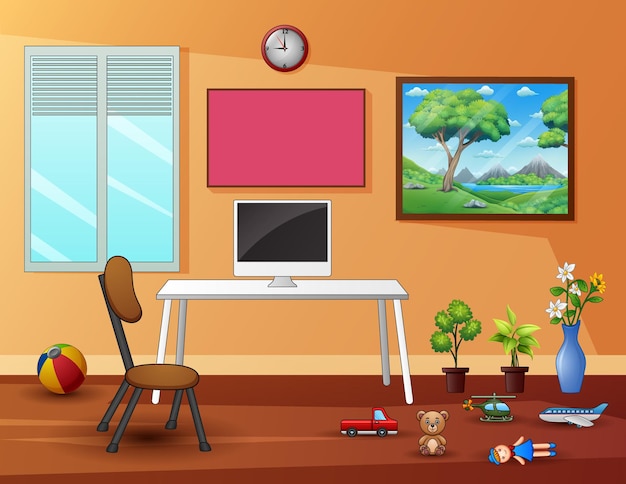
Find the location of a particular element. The height and width of the screenshot is (484, 626). green plant 1 is located at coordinates (444, 367).